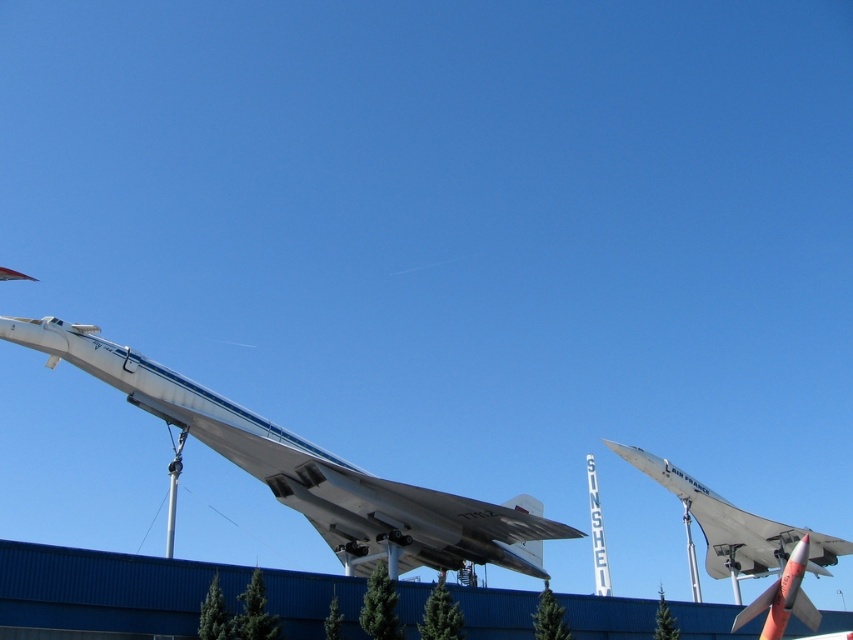
Which is below, white glossy airplane at center or white glossy airplane at right?

white glossy airplane at right is below.

I want to click on white glossy airplane at center, so click(x=308, y=468).

This screenshot has height=640, width=853. What are the coordinates of `white glossy airplane at center` in the screenshot? It's located at (308, 468).